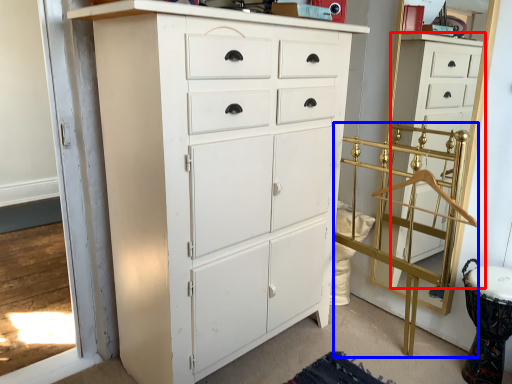
Question: Which of the following is the farthest to the observer, chest of drawers (highlighted by a red box) or bunk bed (highlighted by a blue box)?

Choices:
 (A) chest of drawers
 (B) bunk bed

Answer: (A)